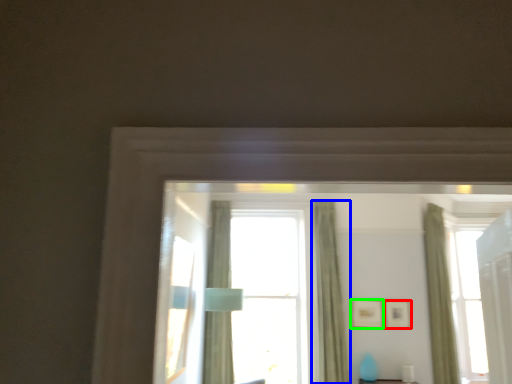
Question: Which object is the closest to the picture frame (highlighted by a red box)? Choose among these: curtain (highlighted by a blue box) or picture frame (highlighted by a green box).

Choices:
 (A) curtain
 (B) picture frame

Answer: (B)